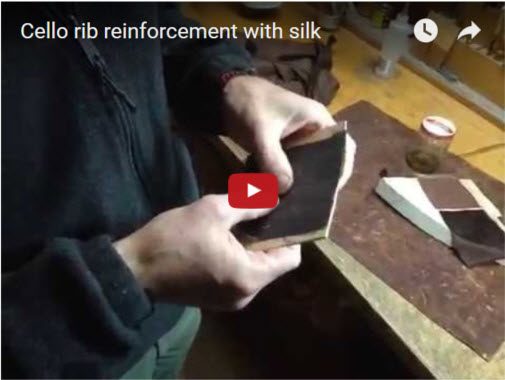
This screenshot has width=505, height=380. Identify the location of floor. (246, 355).